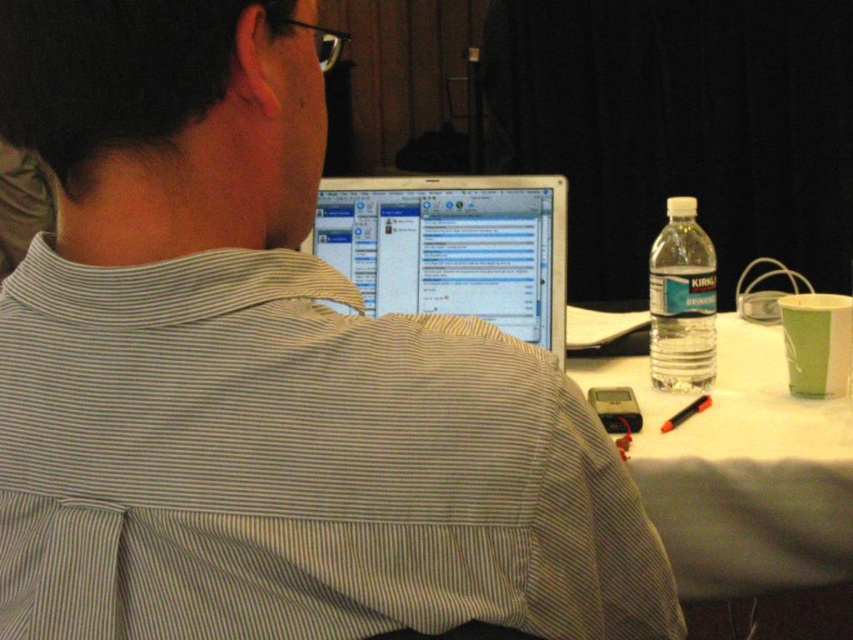
You are organizing a conference and need to place a name tag on the table. The name tag is the size of the white paper at center. Can it fit on top of the shiny silver laptop at center without overlapping the edges?

The white paper at center has a larger size compared to the shiny silver laptop at center. Since the name tag is the size of the white paper, it cannot fit on the laptop as it is larger than the laptop itself.